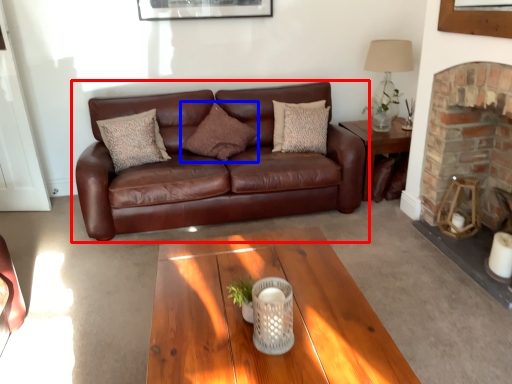
Question: Which point is closer to the camera, studio couch (highlighted by a red box) or pillow (highlighted by a blue box)?

Choices:
 (A) studio couch
 (B) pillow

Answer: (A)